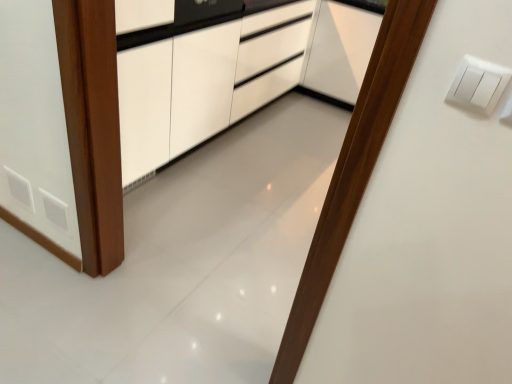
The width and height of the screenshot is (512, 384). What do you see at coordinates (478, 85) in the screenshot?
I see `white plastic light switch at upper right` at bounding box center [478, 85].

You are a GUI agent. You are given a task and a screenshot of the screen. Output one action in this format:
    pyautogui.click(x=<x>, y=<y>)
    Task: Click on the white plastic light switch at upper right
    This screenshot has height=384, width=512.
    Given the screenshot: What is the action you would take?
    [478, 85]

The height and width of the screenshot is (384, 512). What do you see at coordinates (204, 79) in the screenshot? I see `white glossy cabinet at center` at bounding box center [204, 79].

The height and width of the screenshot is (384, 512). I want to click on white glossy cabinet at center, so click(x=204, y=79).

I want to click on white plastic light switch at upper right, so click(478, 85).

Is white glossy cabinet at center to the right of white plastic light switch at upper right from the viewer's perspective?

In fact, white glossy cabinet at center is to the left of white plastic light switch at upper right.

Which object is closer to the camera, white glossy cabinet at center or white plastic light switch at upper right?

white plastic light switch at upper right is closer to the camera.

Considering the points (184, 74) and (488, 65), which point is behind, point (184, 74) or point (488, 65)?

The point (184, 74) is behind.

From the image's perspective, is white glossy cabinet at center positioned above or below white plastic light switch at upper right?

white glossy cabinet at center is above white plastic light switch at upper right.

From a real-world perspective, is white glossy cabinet at center over white plastic light switch at upper right?

Actually, white glossy cabinet at center is physically below white plastic light switch at upper right in the real world.

Is white glossy cabinet at center thinner than white plastic light switch at upper right?

Incorrect, the width of white glossy cabinet at center is not less than that of white plastic light switch at upper right.

In the scene shown: Is white glossy cabinet at center taller than white plastic light switch at upper right?

Yes, white glossy cabinet at center is taller than white plastic light switch at upper right.

Considering the sizes of objects white glossy cabinet at center and white plastic light switch at upper right in the image provided, who is bigger, white glossy cabinet at center or white plastic light switch at upper right?

white glossy cabinet at center.

Is white glossy cabinet at center inside or outside of white plastic light switch at upper right?

white glossy cabinet at center is outside white plastic light switch at upper right.

Is white glossy cabinet at center beside white plastic light switch at upper right?

They are not placed beside each other.

Based on the photo, is white glossy cabinet at center aimed at white plastic light switch at upper right?

No.

How much distance is there between white glossy cabinet at center and white plastic light switch at upper right?

white glossy cabinet at center and white plastic light switch at upper right are 6.19 feet apart from each other.

Locate an element on the screen. The width and height of the screenshot is (512, 384). cabinetry behind the white plastic light switch at upper right is located at coordinates (204, 79).

Considering the positions of objects white plastic light switch at upper right and white glossy cabinet at center in the image provided, who is more to the left, white plastic light switch at upper right or white glossy cabinet at center?

Positioned to the left is white glossy cabinet at center.

Is white plastic light switch at upper right further to camera compared to white glossy cabinet at center?

No, the depth of white plastic light switch at upper right is less than that of white glossy cabinet at center.

Between point (463, 64) and point (132, 182), which one is positioned in front?

Point (463, 64)

From the image's perspective, is white plastic light switch at upper right located above white glossy cabinet at center?

No, from the image's perspective, white plastic light switch at upper right is not above white glossy cabinet at center.

From a real-world perspective, is white plastic light switch at upper right physically above white glossy cabinet at center?

Yes, from a real-world perspective, white plastic light switch at upper right is over white glossy cabinet at center

Between white plastic light switch at upper right and white glossy cabinet at center, which one has larger width?

With larger width is white glossy cabinet at center.

Which of these two, white plastic light switch at upper right or white glossy cabinet at center, stands shorter?

Standing shorter between the two is white plastic light switch at upper right.

Considering the sizes of white plastic light switch at upper right and white glossy cabinet at center in the image, is white plastic light switch at upper right bigger or smaller than white glossy cabinet at center?

In the image, white plastic light switch at upper right appears to be smaller than white glossy cabinet at center.

Consider the image. Is white plastic light switch at upper right outside of white glossy cabinet at center?

Indeed, white plastic light switch at upper right is completely outside white glossy cabinet at center.

Is white plastic light switch at upper right touching white glossy cabinet at center?

No.

Is white plastic light switch at upper right facing towards white glossy cabinet at center?

No, white plastic light switch at upper right is not aimed at white glossy cabinet at center.

In the scene shown: How many degrees apart are the facing directions of white plastic light switch at upper right and white glossy cabinet at center?

white plastic light switch at upper right and white glossy cabinet at center are facing 90 degrees away from each other.

The height and width of the screenshot is (384, 512). I want to click on cabinetry located underneath the white plastic light switch at upper right (from a real-world perspective), so click(204, 79).

Image resolution: width=512 pixels, height=384 pixels. What are the coordinates of `cabinetry that appears above the white plastic light switch at upper right (from the image's perspective)` in the screenshot? It's located at (204, 79).

You are a GUI agent. You are given a task and a screenshot of the screen. Output one action in this format:
    pyautogui.click(x=<x>, y=<y>)
    Task: Click on the cabinetry lying on the left of white plastic light switch at upper right
    Image resolution: width=512 pixels, height=384 pixels.
    Given the screenshot: What is the action you would take?
    pos(204,79)